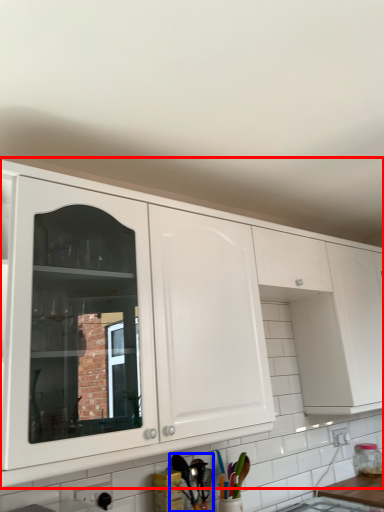
Question: Among these objects, which one is farthest to the camera, cabinetry (highlighted by a red box) or cutlery (highlighted by a blue box)?

Choices:
 (A) cabinetry
 (B) cutlery

Answer: (B)